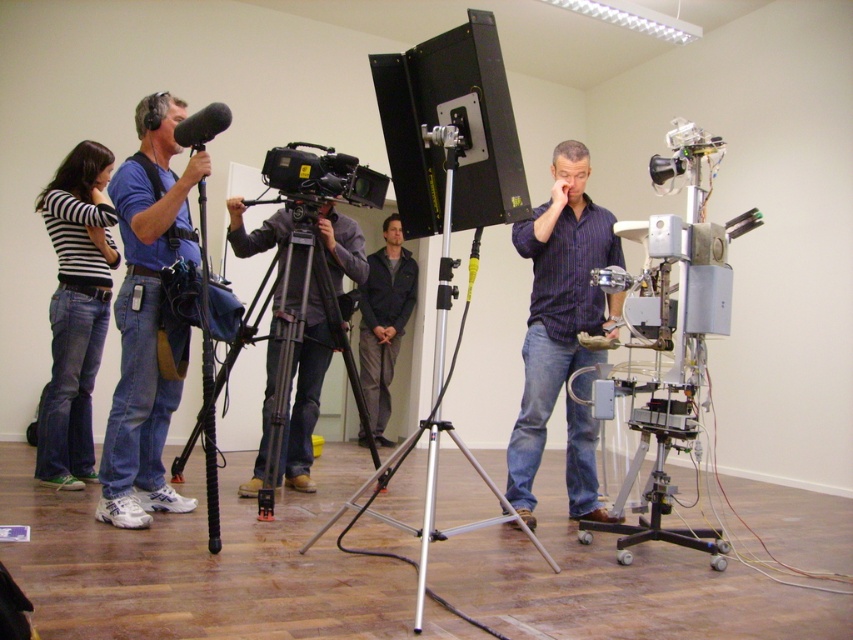
Question: Is dark blue striped shirt at center smaller than matte black camera at center?

Choices:
 (A) yes
 (B) no

Answer: (B)

Question: Which of the following is the closest to the observer?

Choices:
 (A) black metal tripod at center
 (B) matte black camera at center

Answer: (A)

Question: Which point is closer to the camera?

Choices:
 (A) striped cotton shirt at left
 (B) silver metallic tripod at center

Answer: (B)

Question: Based on their relative distances, which object is farther from the blue jeans at left?

Choices:
 (A) dark blue jacket at center
 (B) dark blue striped shirt at center
 (C) silver metallic tripod at center
 (D) black metal tripod at center

Answer: (A)

Question: Is the position of striped cotton shirt at left more distant than that of matte black camera at center?

Choices:
 (A) no
 (B) yes

Answer: (A)

Question: Is blue jeans at left positioned in front of black metal tripod at center?

Choices:
 (A) yes
 (B) no

Answer: (A)